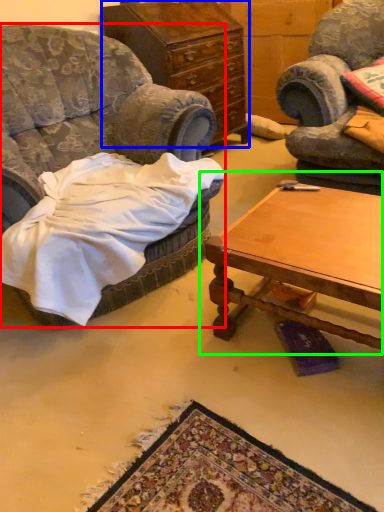
Question: Which is nearer to the chair (highlighted by a red box)? cabinetry (highlighted by a blue box) or coffee table (highlighted by a green box).

Choices:
 (A) cabinetry
 (B) coffee table

Answer: (B)